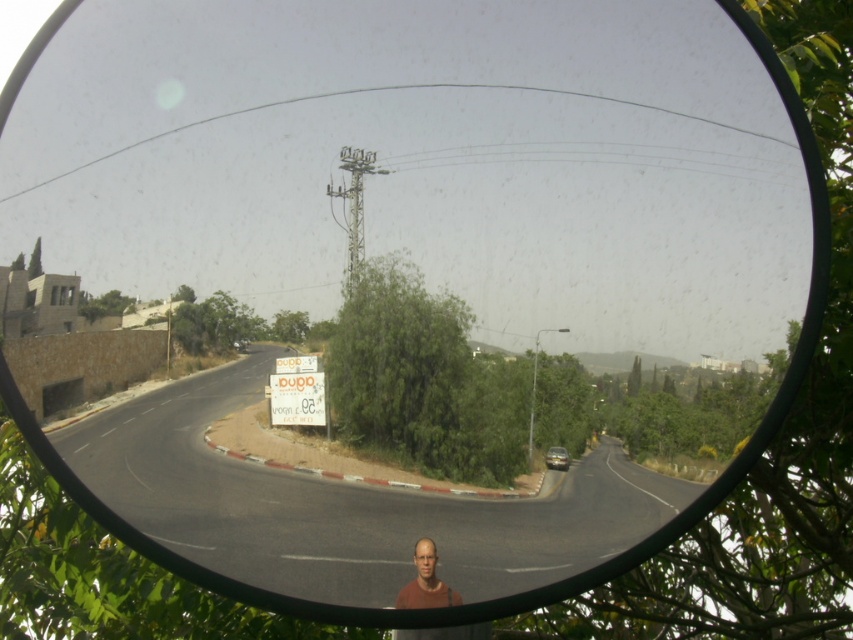
Question: Considering the relative positions of white paper sign at center and smooth brown shirt at lower center in the image provided, where is white paper sign at center located with respect to smooth brown shirt at lower center?

Choices:
 (A) right
 (B) left

Answer: (B)

Question: Can you confirm if white paper sign at center is bigger than smooth brown shirt at lower center?

Choices:
 (A) no
 (B) yes

Answer: (B)

Question: Which object is closer to the camera taking this photo?

Choices:
 (A) white paper sign at center
 (B) smooth brown shirt at lower center
 (C) silver metallic car at center

Answer: (B)

Question: Is white paper sign at center smaller than smooth brown shirt at lower center?

Choices:
 (A) no
 (B) yes

Answer: (A)

Question: Among these points, which one is nearest to the camera?

Choices:
 (A) (422, 572)
 (B) (553, 451)
 (C) (300, 369)

Answer: (A)

Question: Which point is closer to the camera taking this photo?

Choices:
 (A) (412, 579)
 (B) (323, 381)

Answer: (A)